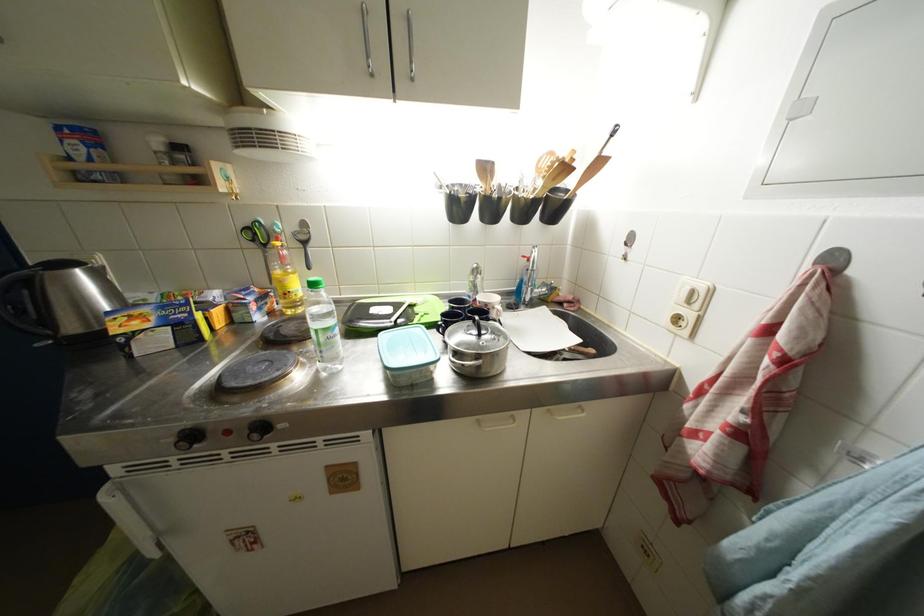
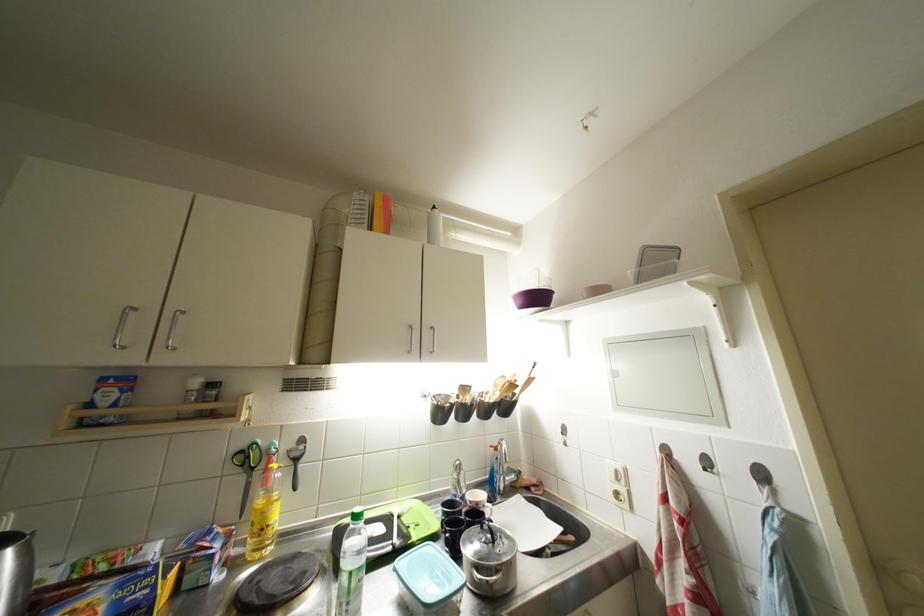
Locate, in the second image, the point that corresponds to point (487, 339) in the first image.

(500, 546)